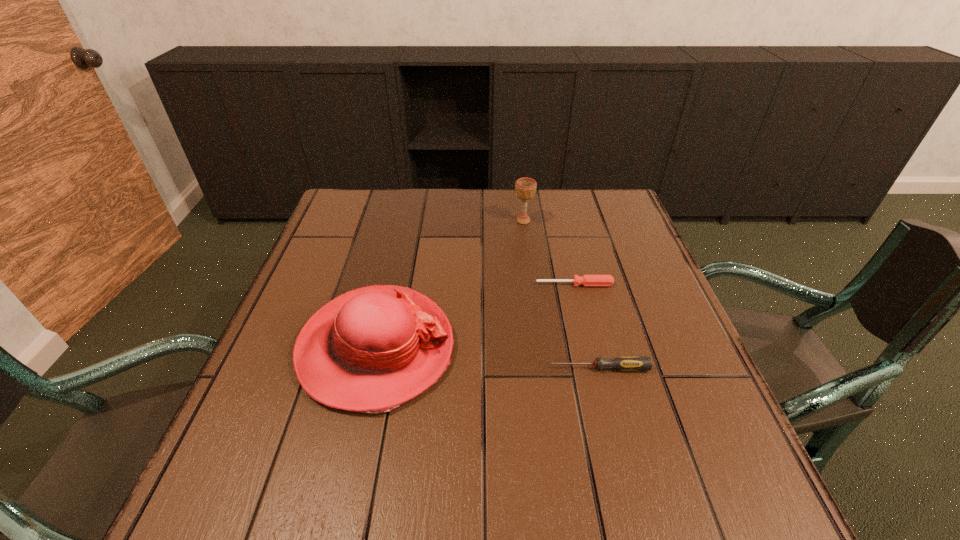
Where is `free space that satisfies the following two spatial constraints: 1. on the front side of the second farthest object; 2. on the right side of the farthest object`? free space that satisfies the following two spatial constraints: 1. on the front side of the second farthest object; 2. on the right side of the farthest object is located at coordinates (532, 285).

At what (x,y) coordinates should I click in order to perform the action: click on vacant region that satisfies the following two spatial constraints: 1. on the front side of the chalice; 2. at the front of the leftmost object with a bow. Please return your answer as a coordinate pair (x, y). The width and height of the screenshot is (960, 540). Looking at the image, I should click on point(540,348).